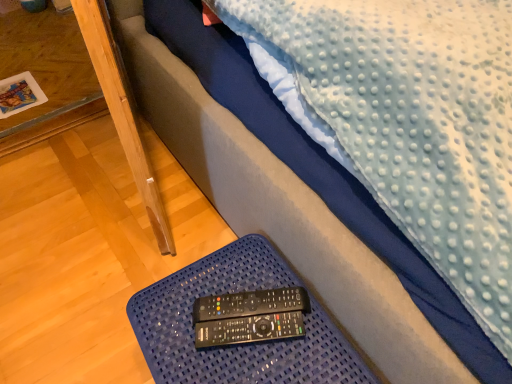
The width and height of the screenshot is (512, 384). I want to click on free space to the left of black plastic remote at lower center, the 2th control when ordered from back to front, so click(175, 331).